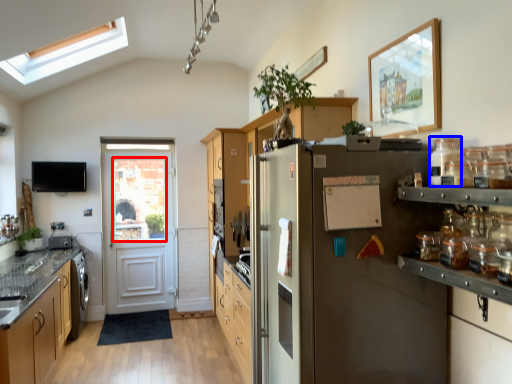
Question: Which point is closer to the camera, window screen (highlighted by a red box) or glass jar (highlighted by a blue box)?

Choices:
 (A) window screen
 (B) glass jar

Answer: (B)